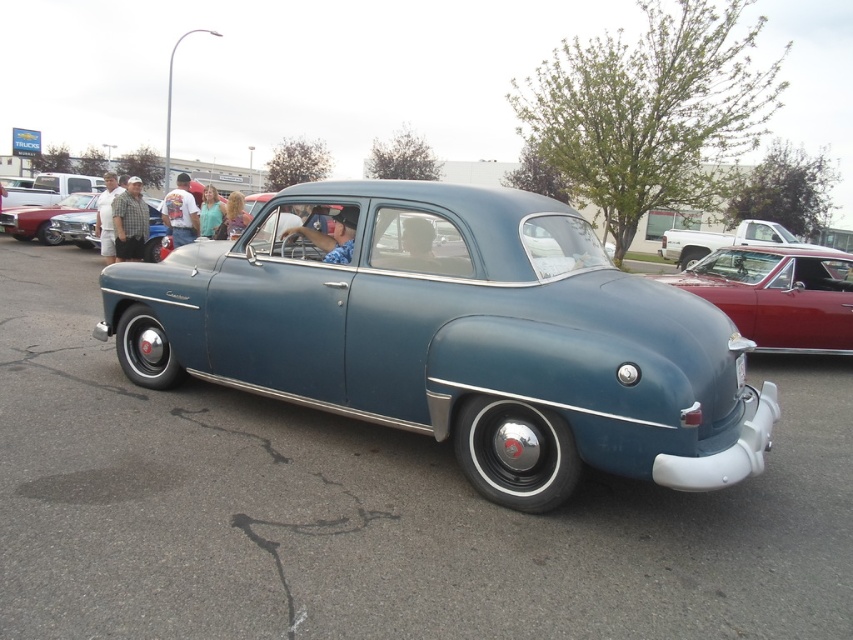
You are standing at the event and want to take a photo of the glossy red car at right. If your camera has a maximum focus range of 7 meters, will you be able to capture the car clearly?

The glossy red car at right is 6.97 meters away from the viewer, which is within the camera maximum focus range of 7 meters, so yes, the camera can focus on the glossy red car at right clearly.

You are standing in front of the vintage car at the event. You notice two points marked on the car, one at point coordinates (799,268) and another at point coordinates (178,200). Which point is closer to your viewpoint?

Point (799,268) is closer to the camera than point (178,200).